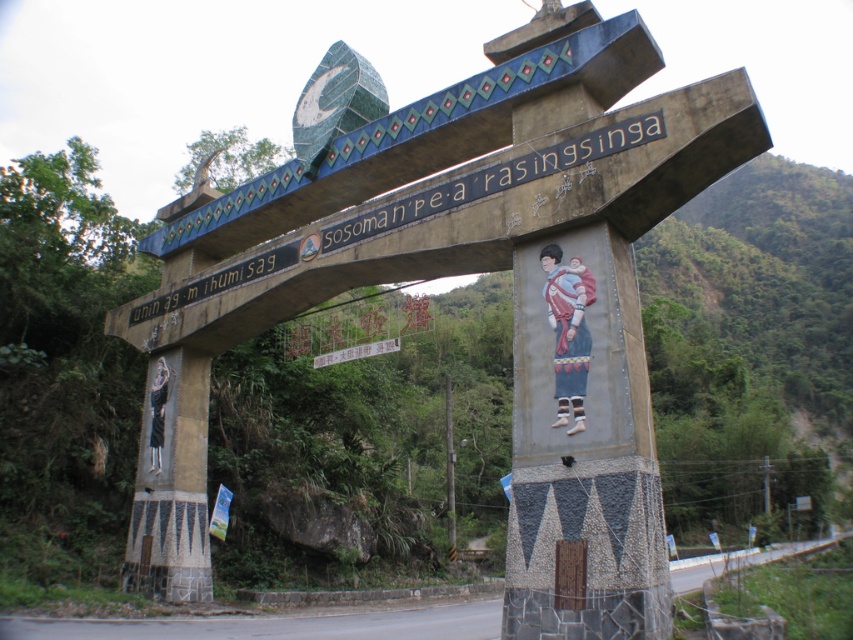
In the scene shown: Who is more distant from viewer, (635, 141) or (445, 502)?

The point (445, 502) is behind.

Can you confirm if carved stone sign at center is positioned above metallic pole at center?

Yes, carved stone sign at center is above metallic pole at center.

Between point (642, 120) and point (447, 531), which one is positioned behind?

Point (447, 531)

The height and width of the screenshot is (640, 853). I want to click on carved stone sign at center, so click(496, 179).